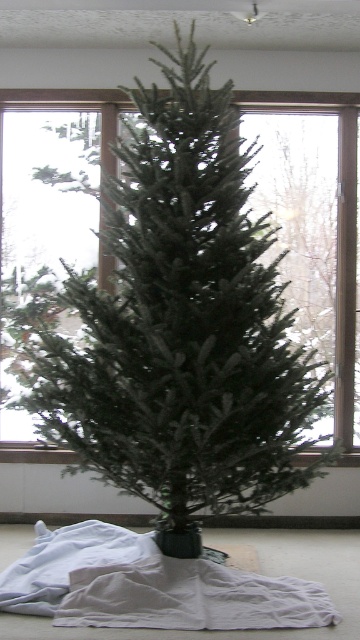
Which is behind, point (90, 572) or point (340, 317)?

Point (340, 317)

Does point (205, 624) come in front of point (253, 99)?

That is True.

The width and height of the screenshot is (360, 640). Identify the location of white soft blanket at lower center. (150, 586).